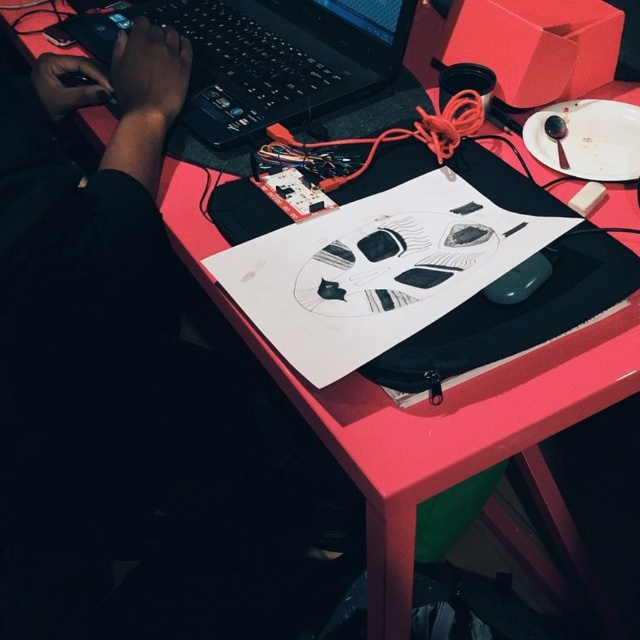
Does black plastic laptop at upper left appear on the left side of black matte mouse at center?

Yes, black plastic laptop at upper left is to the left of black matte mouse at center.

This screenshot has width=640, height=640. Identify the location of black plastic laptop at upper left. (266, 56).

Image resolution: width=640 pixels, height=640 pixels. In order to click on black plastic laptop at upper left in this screenshot , I will do `click(266, 56)`.